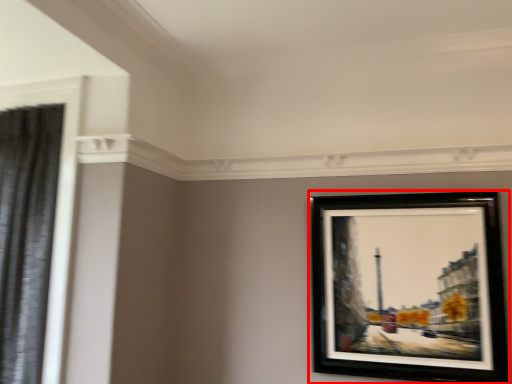
Question: From the image's perspective, where is picture frame (annotated by the red box) located in relation to shower curtain in the image?

Choices:
 (A) below
 (B) above

Answer: (A)